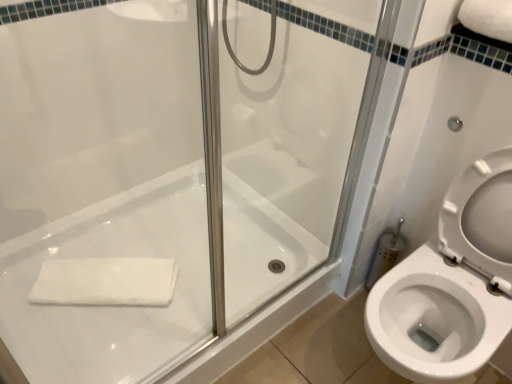
The height and width of the screenshot is (384, 512). I want to click on white glossy bath at center, so click(x=111, y=306).

Consider the image. Measure the distance between point (142, 304) and camera.

5.03 feet.

This screenshot has height=384, width=512. What are the coordinates of `white glossy bath at center` in the screenshot? It's located at (111, 306).

From the image's perspective, between white cotton bath towel at lower left, which is the first bath towel in left-to-right order, and white glossy bath at center, who is located below?

white glossy bath at center.

Locate an element on the screen. This screenshot has width=512, height=384. bath that is below the white cotton bath towel at lower left, which appears as the first bath towel when viewed from the back (from the image's perspective) is located at coordinates (111, 306).

Does point (173, 273) appear closer or farther from the camera than point (106, 212)?

Point (173, 273) is closer to the camera than point (106, 212).

Which object is more forward, white cotton bath towel at lower left, which appears as the second bath towel when viewed from the right, or white glossy bath at center?

white glossy bath at center.

Is white glossy bath at center far away from white soft towel at upper right, arranged as the first bath towel when viewed from the right?

Yes, white glossy bath at center is far from white soft towel at upper right, arranged as the first bath towel when viewed from the right.

From the image's perspective, which bath towel is the 2nd one above the white glossy bath at center? Please provide its 2D coordinates.

[(488, 18)]

From the image's perspective, does white glossy bath at center appear higher than white soft towel at upper right, acting as the 2th bath towel starting from the back?

No, from the image's perspective, white glossy bath at center is not on top of white soft towel at upper right, acting as the 2th bath towel starting from the back.

From a real-world perspective, who is located higher, white soft towel at upper right, arranged as the first bath towel when viewed from the right, or white glossy bath at center?

white soft towel at upper right, arranged as the first bath towel when viewed from the right, is physically above.

Is white soft towel at upper right, the first bath towel in the top-to-bottom sequence, further to camera compared to white glossy bath at center?

No, it is not.

From the image's perspective, does white soft towel at upper right, arranged as the first bath towel when viewed from the right, appear lower than white glossy bath at center?

No.

Is white soft towel at upper right, acting as the 2th bath towel starting from the back, facing away from white glossy bath at center?

No, white soft towel at upper right, acting as the 2th bath towel starting from the back, is not facing the opposite direction of white glossy bath at center.

Between white glossy bath at center and white cotton bath towel at lower left, which appears as the second bath towel when viewed from the right, which one appears on the left side from the viewer's perspective?

white cotton bath towel at lower left, which appears as the second bath towel when viewed from the right, is more to the left.

Which is in front, white glossy bath at center or white cotton bath towel at lower left, which appears as the first bath towel when viewed from the back?

Positioned in front is white glossy bath at center.

From the image's perspective, which is above, white glossy bath at center or white cotton bath towel at lower left, arranged as the second bath towel when viewed from the top?

white cotton bath towel at lower left, arranged as the second bath towel when viewed from the top.

From the image's perspective, between white cotton bath towel at lower left, which is the first bath towel in left-to-right order, and white soft towel at upper right, the 2th bath towel positioned from the left, who is located below?

white cotton bath towel at lower left, which is the first bath towel in left-to-right order, is shown below in the image.

From a real-world perspective, does white cotton bath towel at lower left, which is the first bath towel in left-to-right order, stand above white soft towel at upper right, acting as the 1th bath towel starting from the front?

No, from a real-world perspective, white cotton bath towel at lower left, which is the first bath towel in left-to-right order, is not above white soft towel at upper right, acting as the 1th bath towel starting from the front.

Can you confirm if white cotton bath towel at lower left, which is the first bath towel in left-to-right order, is positioned to the right of white soft towel at upper right, the 2th bath towel positioned from the left?

No.

Which of these two, white cotton bath towel at lower left, which appears as the first bath towel when viewed from the back, or white soft towel at upper right, the first bath towel in the top-to-bottom sequence, is bigger?

white cotton bath towel at lower left, which appears as the first bath towel when viewed from the back.

Is white soft towel at upper right, marked as the second bath towel in a bottom-to-top arrangement, bigger or smaller than white cotton bath towel at lower left, the 2th bath towel from the front?

Considering their sizes, white soft towel at upper right, marked as the second bath towel in a bottom-to-top arrangement, takes up less space than white cotton bath towel at lower left, the 2th bath towel from the front.

Is point (510, 32) in front of point (75, 297)?

Yes, point (510, 32) is in front of point (75, 297).

Is white soft towel at upper right, the 2th bath towel positioned from the left, not inside white cotton bath towel at lower left, which appears as the first bath towel when ordered from the bottom?

Yes, white soft towel at upper right, the 2th bath towel positioned from the left, is not within white cotton bath towel at lower left, which appears as the first bath towel when ordered from the bottom.

In the scene shown: From the image's perspective, would you say white soft towel at upper right, the 2th bath towel positioned from the left, is positioned over white cotton bath towel at lower left, which is the first bath towel in left-to-right order?

Yes, from the image's perspective, white soft towel at upper right, the 2th bath towel positioned from the left, is above white cotton bath towel at lower left, which is the first bath towel in left-to-right order.

The height and width of the screenshot is (384, 512). In order to click on bath in front of the white cotton bath towel at lower left, which appears as the first bath towel when viewed from the back in this screenshot , I will do `click(111, 306)`.

Image resolution: width=512 pixels, height=384 pixels. What are the coordinates of `bath below the white soft towel at upper right, marked as the second bath towel in a bottom-to-top arrangement (from a real-world perspective)` in the screenshot? It's located at (111, 306).

From the picture: Estimate the real-world distances between objects in this image. Which object is closer to white cotton bath towel at lower left, the 2th bath towel from the front, white glossy bath at center or white soft towel at upper right, the 2th bath towel positioned from the left?

white glossy bath at center is positioned closer to the anchor white cotton bath towel at lower left, the 2th bath towel from the front.

Based on their spatial positions, is white cotton bath towel at lower left, which is the first bath towel in left-to-right order, or white soft towel at upper right, the 2th bath towel positioned from the left, closer to white glossy bath at center?

Among the two, white cotton bath towel at lower left, which is the first bath towel in left-to-right order, is located nearer to white glossy bath at center.

Estimate the real-world distances between objects in this image. Which object is closer to white soft towel at upper right, arranged as the first bath towel when viewed from the right, white glossy bath at center or white cotton bath towel at lower left, which appears as the first bath towel when viewed from the back?

white glossy bath at center is positioned closer to the anchor white soft towel at upper right, arranged as the first bath towel when viewed from the right.

Which object lies nearer to the anchor point white glossy bath at center, white soft towel at upper right, arranged as the first bath towel when viewed from the right, or white cotton bath towel at lower left, which appears as the first bath towel when ordered from the bottom?

white cotton bath towel at lower left, which appears as the first bath towel when ordered from the bottom, lies closer to white glossy bath at center than the other object.

Estimate the real-world distances between objects in this image. Which object is further from white cotton bath towel at lower left, which is the first bath towel in left-to-right order, white soft towel at upper right, the first bath towel in the top-to-bottom sequence, or white glossy bath at center?

white soft towel at upper right, the first bath towel in the top-to-bottom sequence, lies further to white cotton bath towel at lower left, which is the first bath towel in left-to-right order, than the other object.

Based on their spatial positions, is white cotton bath towel at lower left, the 2th bath towel from the front, or white glossy bath at center closer to white soft towel at upper right, marked as the second bath towel in a bottom-to-top arrangement?

Based on the image, white glossy bath at center appears to be nearer to white soft towel at upper right, marked as the second bath towel in a bottom-to-top arrangement.

Identify the location of bath between white cotton bath towel at lower left, which appears as the first bath towel when viewed from the back, and white soft towel at upper right, the 2th bath towel positioned from the left. This screenshot has height=384, width=512. (111, 306).